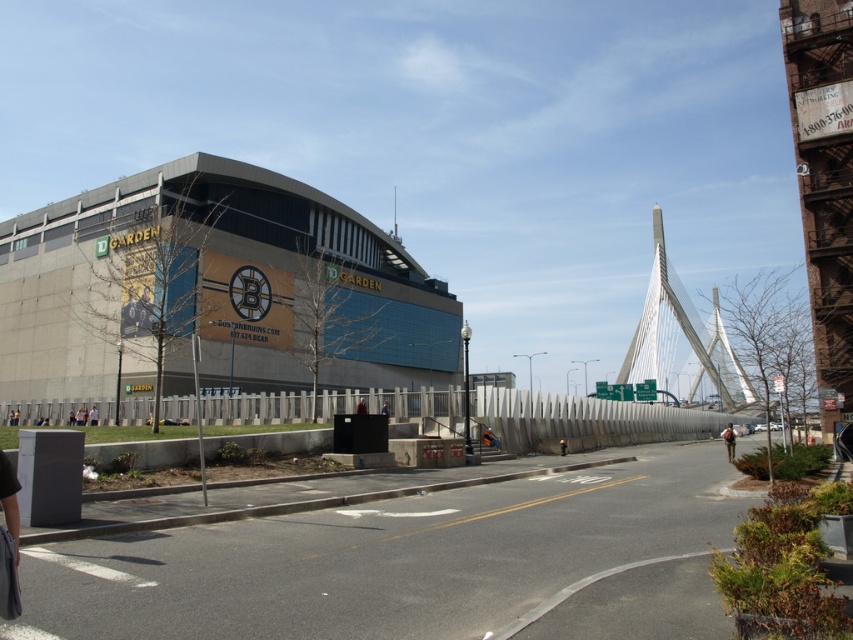
You are a photographer at the event and want to capture both the brown leather jacket at center and the dark blue suit at center in the same frame. Which one should you focus on first to ensure both are in the shot?

A: The brown leather jacket at center is positioned on the right side of dark blue suit at center, so you should focus on the dark blue suit at center first to ensure both are in the shot.

You are organizing a photo shoot at the TD Garden and need to position two models wearing a yellow fabric person at center and a blue fabric jacket at center. Based on their sizes, which model should be placed closer to the camera to ensure both appear proportionate in the final image?

The yellow fabric person at center is narrower than the blue fabric jacket at center. To make both appear proportionate, the yellow fabric person at center should be placed closer to the camera since it is smaller in width, allowing it to appear larger in the photo.

You are a photographer standing in front of the TD Garden and notice an orange fabric bag at center and a white cotton shirt at center. Which item would appear larger in your camera viewfinder?

The white cotton shirt at center appears larger in the camera viewfinder because it is bigger than the orange fabric bag at center.